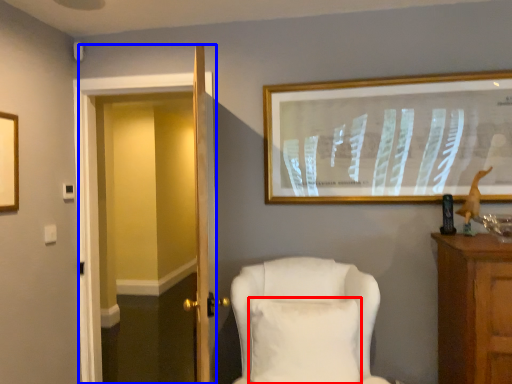
Question: Which object appears closest to the camera in this image, pillow (highlighted by a red box) or glass door (highlighted by a blue box)?

Choices:
 (A) pillow
 (B) glass door

Answer: (A)